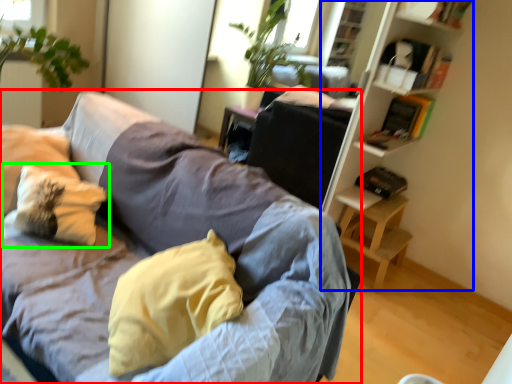
Question: Based on their relative distances, which object is nearer to studio couch (highlighted by a red box)? Choose from bookshelf (highlighted by a blue box) and pillow (highlighted by a green box).

Choices:
 (A) bookshelf
 (B) pillow

Answer: (B)